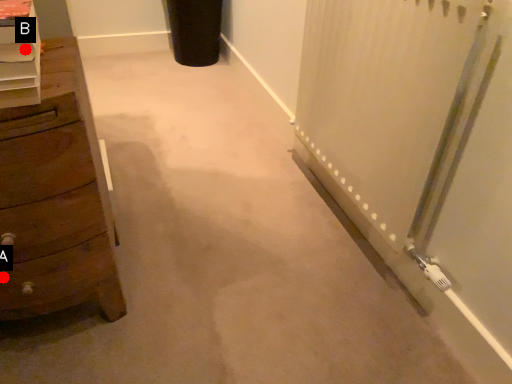
Question: Two points are circled on the image, labeled by A and B beside each circle. Which point is further to the camera?

Choices:
 (A) A is further
 (B) B is further

Answer: (A)